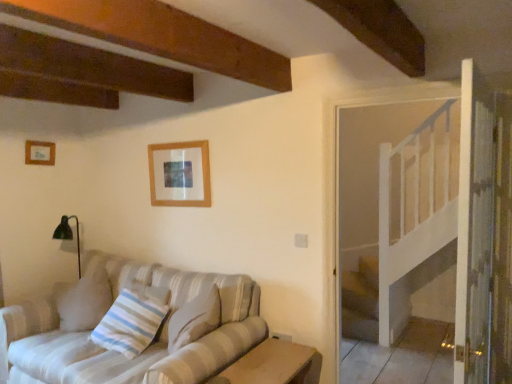
Image resolution: width=512 pixels, height=384 pixels. I want to click on wooden picture frame at upper center, arranged as the 1th picture frame when viewed from the right, so tap(180, 175).

This screenshot has height=384, width=512. What do you see at coordinates (270, 364) in the screenshot?
I see `wooden table at lower center` at bounding box center [270, 364].

This screenshot has width=512, height=384. In order to click on wooden picture frame at upper left, the 1th picture frame viewed from the left in this screenshot , I will do `click(39, 153)`.

The image size is (512, 384). What are the coordinates of `wooden picture frame at upper center, positioned as the first picture frame in front-to-back order` in the screenshot? It's located at (180, 175).

Which object is positioned more to the right, wooden picture frame at upper center, arranged as the 1th picture frame when viewed from the right, or striped fabric pillow at lower left?

Positioned to the right is wooden picture frame at upper center, arranged as the 1th picture frame when viewed from the right.

Find the location of a particular element. Image resolution: width=512 pixels, height=384 pixels. pillow located underneath the wooden picture frame at upper center, positioned as the first picture frame in front-to-back order (from a real-world perspective) is located at coordinates (133, 320).

Is wooden picture frame at upper center, positioned as the 2th picture frame in left-to-right order, outside of striped fabric pillow at lower left?

wooden picture frame at upper center, positioned as the 2th picture frame in left-to-right order, is positioned outside striped fabric pillow at lower left.

Which object is thinner, wooden table at lower center or wooden picture frame at upper center, positioned as the 2th picture frame in left-to-right order?

Thinner between the two is wooden picture frame at upper center, positioned as the 2th picture frame in left-to-right order.

Which is closer, (293,367) or (191,167)?

Point (293,367) appears to be closer to the viewer than point (191,167).

From a real-world perspective, which is physically above, wooden table at lower center or wooden picture frame at upper center, positioned as the 2th picture frame in left-to-right order?

From a 3D spatial view, wooden picture frame at upper center, positioned as the 2th picture frame in left-to-right order, is above.

In terms of size, does wooden table at lower center appear bigger or smaller than wooden picture frame at upper center, arranged as the 2th picture frame when viewed from the back?

wooden table at lower center is bigger than wooden picture frame at upper center, arranged as the 2th picture frame when viewed from the back.

Do you think striped fabric pillow at lower left is within wooden picture frame at upper center, positioned as the first picture frame in front-to-back order, or outside of it?

striped fabric pillow at lower left is not enclosed by wooden picture frame at upper center, positioned as the first picture frame in front-to-back order.

Can you confirm if striped fabric pillow at lower left is positioned to the left of wooden picture frame at upper center, positioned as the 2th picture frame in left-to-right order?

Correct, you'll find striped fabric pillow at lower left to the left of wooden picture frame at upper center, positioned as the 2th picture frame in left-to-right order.

What's the angular difference between striped fabric pillow at lower left and wooden picture frame at upper center, arranged as the 2th picture frame when viewed from the back,'s facing directions?

striped fabric pillow at lower left and wooden picture frame at upper center, arranged as the 2th picture frame when viewed from the back, are facing 16.5 degrees away from each other.

From a real-world perspective, relative to wooden picture frame at upper center, arranged as the 2th picture frame when viewed from the back, is striped fabric pillow at lower left vertically above or below?

From a real-world perspective, striped fabric pillow at lower left is physically below wooden picture frame at upper center, arranged as the 2th picture frame when viewed from the back.

Is wooden picture frame at upper center, arranged as the 2th picture frame when viewed from the back, not inside wooden picture frame at upper left, the second picture frame when ordered from right to left?

wooden picture frame at upper center, arranged as the 2th picture frame when viewed from the back, lies outside wooden picture frame at upper left, the second picture frame when ordered from right to left,'s area.

Is wooden picture frame at upper center, positioned as the 2th picture frame in left-to-right order, thinner than wooden picture frame at upper left, the 1th picture frame viewed from the left?

Yes.

Does point (182, 175) come farther from viewer compared to point (28, 164)?

No, (182, 175) is closer to viewer.

Is wooden picture frame at upper center, positioned as the 2th picture frame in left-to-right order, oriented towards wooden picture frame at upper left, the first picture frame positioned from the back?

No, wooden picture frame at upper center, positioned as the 2th picture frame in left-to-right order, is not oriented towards wooden picture frame at upper left, the first picture frame positioned from the back.

Which picture frame is the 2nd one when counting from the back of the wooden table at lower center? Please provide its 2D coordinates.

[(39, 153)]

Can you confirm if wooden picture frame at upper left, the 1th picture frame viewed from the left, is taller than wooden table at lower center?

No.

Considering the relative sizes of wooden picture frame at upper left, the second picture frame when ordered from right to left, and wooden table at lower center in the image provided, is wooden picture frame at upper left, the second picture frame when ordered from right to left, wider than wooden table at lower center?

No.

From a real-world perspective, between wooden picture frame at upper left, placed as the second picture frame when sorted from front to back, and wooden table at lower center, who is vertically lower?

wooden table at lower center.

Is striped fabric pillow at lower left closer to camera compared to wooden table at lower center?

That is False.

Which is behind, point (136, 332) or point (217, 376)?

Positioned behind is point (136, 332).

Based on the photo, from a real-world perspective, which object rests below the other?

In real-world perspective, wooden table at lower center is lower.

In the scene shown: Could you tell me if striped fabric pillow at lower left is turned towards wooden table at lower center?

No, striped fabric pillow at lower left is not facing towards wooden table at lower center.

Is textured beige couch at lower left beside wooden table at lower center?

textured beige couch at lower left and wooden table at lower center are not in contact.

From their relative heights in the image, would you say textured beige couch at lower left is taller or shorter than wooden table at lower center?

In the image, textured beige couch at lower left appears to be taller than wooden table at lower center.

How far apart are textured beige couch at lower left and wooden table at lower center?

They are 22.83 inches apart.

Between textured beige couch at lower left and wooden table at lower center, which one has larger size?

With larger size is textured beige couch at lower left.

I want to click on pillow located on the left of wooden picture frame at upper center, arranged as the 1th picture frame when viewed from the right, so click(133, 320).

From a real-world perspective, which picture frame is the 1st one above the wooden table at lower center? Please provide its 2D coordinates.

[(180, 175)]

Considering their positions, is wooden picture frame at upper center, positioned as the 2th picture frame in left-to-right order, positioned further to striped fabric pillow at lower left than wooden picture frame at upper left, the first picture frame positioned from the back?

wooden picture frame at upper left, the first picture frame positioned from the back.

Considering their positions, is wooden picture frame at upper center, arranged as the 1th picture frame when viewed from the right, positioned closer to wooden table at lower center than wooden picture frame at upper left, the second picture frame when ordered from right to left?

Based on the image, wooden picture frame at upper center, arranged as the 1th picture frame when viewed from the right, appears to be nearer to wooden table at lower center.

Looking at the image, which one is located further to wooden picture frame at upper left, the 1th picture frame viewed from the left, striped fabric pillow at lower left or textured beige couch at lower left?

The object further to wooden picture frame at upper left, the 1th picture frame viewed from the left, is textured beige couch at lower left.

From the image, which object appears to be nearer to striped fabric pillow at lower left, wooden table at lower center or wooden picture frame at upper left, placed as the second picture frame when sorted from front to back?

wooden table at lower center lies closer to striped fabric pillow at lower left than the other object.

From the image, which object appears to be nearer to wooden picture frame at upper left, the second picture frame when ordered from right to left, wooden table at lower center or striped fabric pillow at lower left?

Based on the image, striped fabric pillow at lower left appears to be nearer to wooden picture frame at upper left, the second picture frame when ordered from right to left.

Looking at the image, which one is located further to striped fabric pillow at lower left, wooden picture frame at upper left, the 1th picture frame viewed from the left, or wooden picture frame at upper center, arranged as the 2th picture frame when viewed from the back?

Based on the image, wooden picture frame at upper left, the 1th picture frame viewed from the left, appears to be further to striped fabric pillow at lower left.

Which object lies further to the anchor point wooden picture frame at upper left, the second picture frame when ordered from right to left, textured beige couch at lower left or wooden table at lower center?

wooden table at lower center lies further to wooden picture frame at upper left, the second picture frame when ordered from right to left, than the other object.

From the image, which object appears to be nearer to textured beige couch at lower left, striped fabric pillow at lower left or wooden table at lower center?

striped fabric pillow at lower left.

Find the location of `picture frame between wooden picture frame at upper left, placed as the second picture frame when sorted from front to back, and striped fabric pillow at lower left, in the vertical direction`. picture frame between wooden picture frame at upper left, placed as the second picture frame when sorted from front to back, and striped fabric pillow at lower left, in the vertical direction is located at coordinates (180, 175).

You are a GUI agent. You are given a task and a screenshot of the screen. Output one action in this format:
    pyautogui.click(x=<x>, y=<y>)
    Task: Click on the pillow between textured beige couch at lower left and wooden table at lower center in the horizontal direction
    
    Given the screenshot: What is the action you would take?
    point(133,320)

Where is `pillow that lies between wooden picture frame at upper center, positioned as the 2th picture frame in left-to-right order, and wooden table at lower center from top to bottom`? Image resolution: width=512 pixels, height=384 pixels. pillow that lies between wooden picture frame at upper center, positioned as the 2th picture frame in left-to-right order, and wooden table at lower center from top to bottom is located at coordinates (133, 320).

Locate an element on the screen. The image size is (512, 384). pillow that lies between wooden picture frame at upper left, the second picture frame when ordered from right to left, and textured beige couch at lower left from top to bottom is located at coordinates (133, 320).